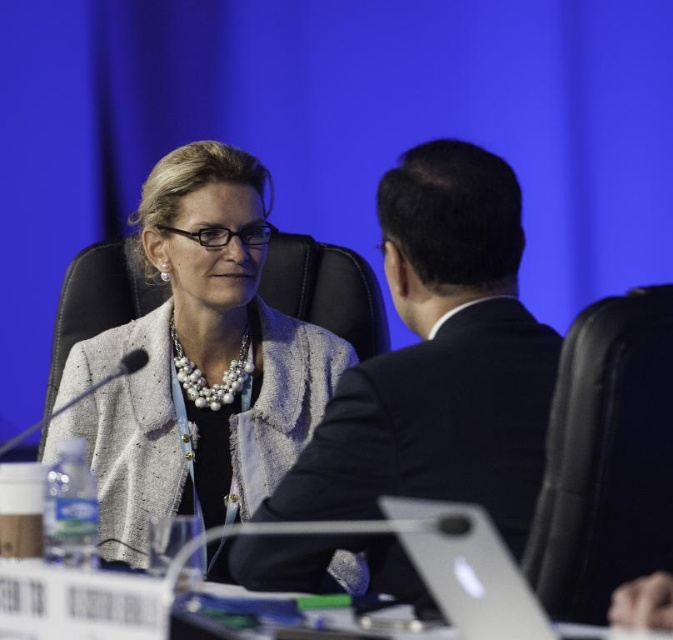
Question: Which of the following is the closest to the observer?

Choices:
 (A) (413, 552)
 (B) (452, 452)

Answer: (A)

Question: Which of these objects is positioned farthest from the dark suit at center?

Choices:
 (A) matte gray blazer at center
 (B) silver metallic laptop at center

Answer: (A)

Question: Is dark suit at center to the right of silver metallic laptop at center from the viewer's perspective?

Choices:
 (A) yes
 (B) no

Answer: (B)

Question: Which of these objects is positioned closest to the dark suit at center?

Choices:
 (A) silver metallic laptop at center
 (B) matte gray blazer at center

Answer: (A)

Question: Is dark suit at center further to camera compared to matte gray blazer at center?

Choices:
 (A) yes
 (B) no

Answer: (B)

Question: Is dark suit at center wider than matte gray blazer at center?

Choices:
 (A) no
 (B) yes

Answer: (A)